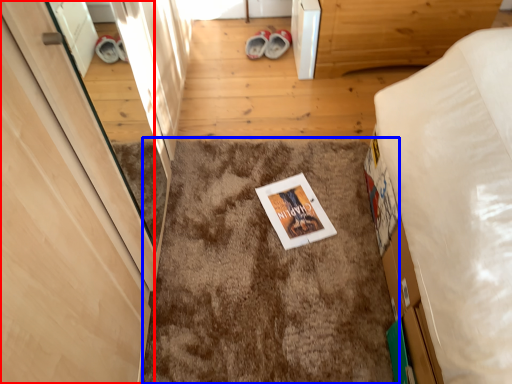
Question: Which object is further to the camera taking this photo, door (highlighted by a red box) or mat (highlighted by a blue box)?

Choices:
 (A) door
 (B) mat

Answer: (B)